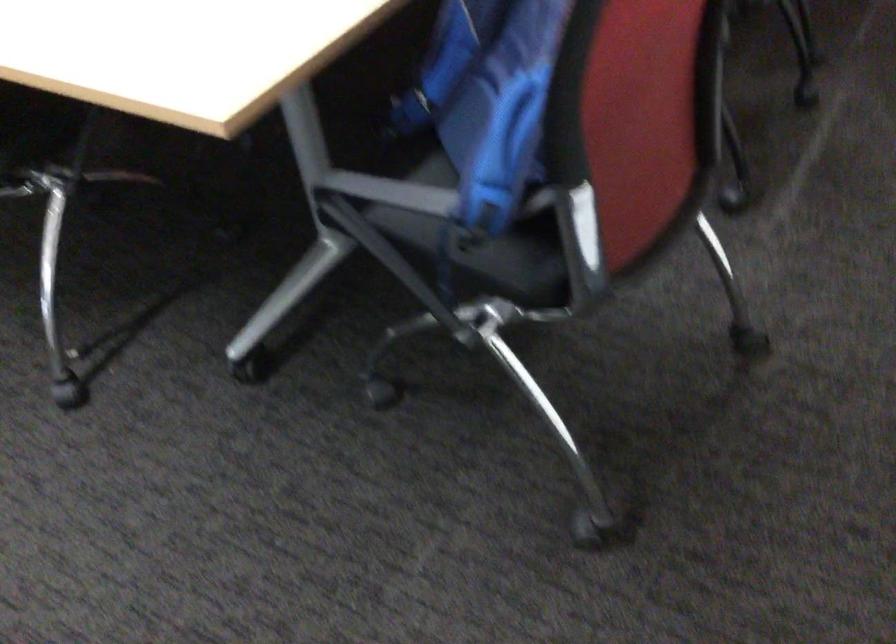
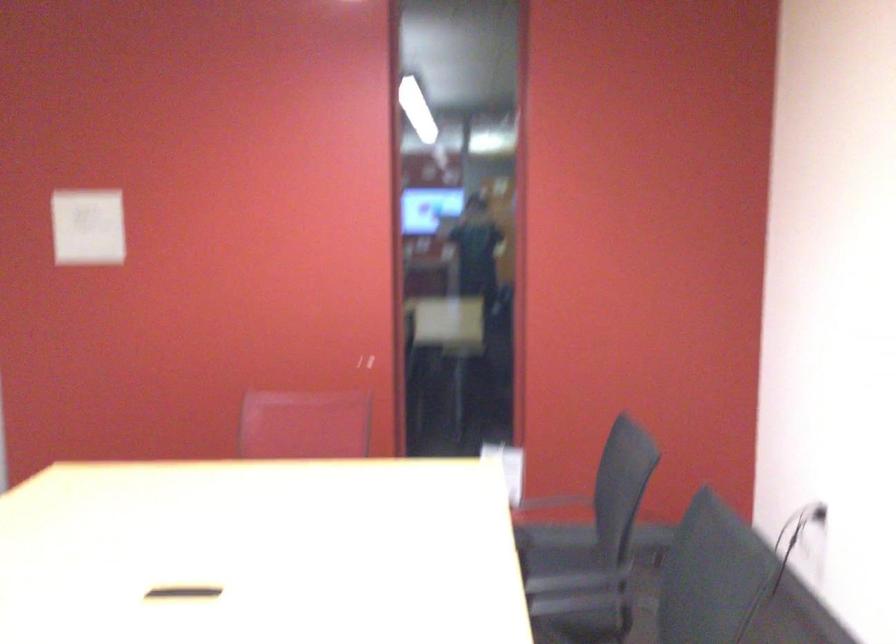
The first image is from the beginning of the video and the second image is from the end. How did the camera likely rotate when shooting the video?

The camera rotated toward right-up.